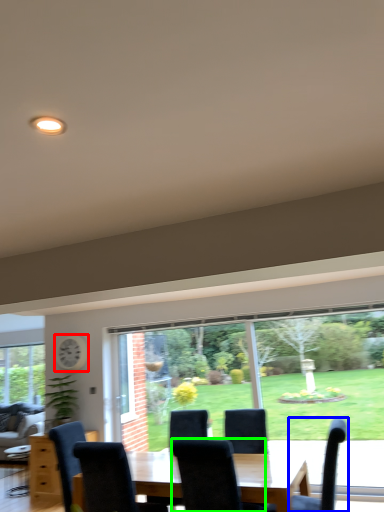
Question: Which object is the farthest from clock (highlighted by a red box)? Choose among these: chair (highlighted by a blue box) or chair (highlighted by a green box).

Choices:
 (A) chair
 (B) chair

Answer: (A)